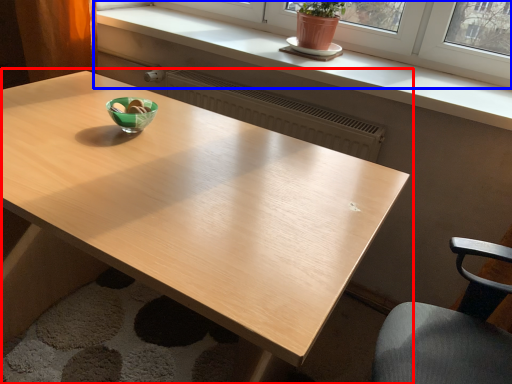
Question: Which object is further to the camera taking this photo, table (highlighted by a red box) or window (highlighted by a blue box)?

Choices:
 (A) table
 (B) window

Answer: (B)